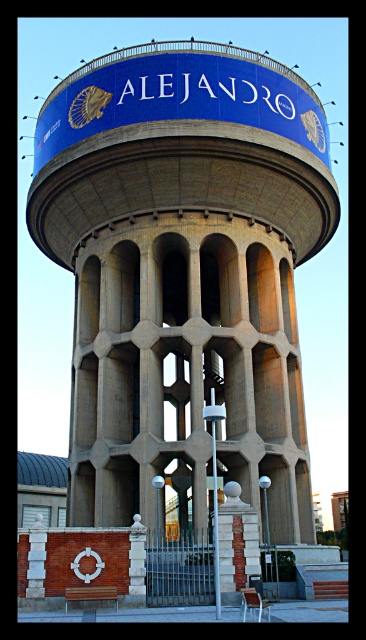
Find the location of `concrete water tower at center`. concrete water tower at center is located at coordinates click(x=184, y=273).

Based on the photo, which is above, concrete water tower at center or brick textured column at center?

concrete water tower at center is higher up.

Where is `concrete water tower at center`? Image resolution: width=366 pixels, height=640 pixels. concrete water tower at center is located at coordinates (184, 273).